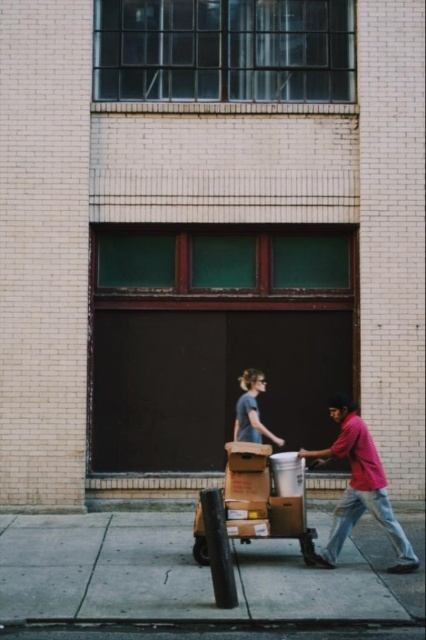
Is matte black trolley at center further to camera compared to matte gray shirt at center?

No, it is not.

In the scene shown: Does matte black trolley at center have a lesser width compared to matte gray shirt at center?

Incorrect, matte black trolley at center's width is not less than matte gray shirt at center's.

Where is `matte black trolley at center`? This screenshot has width=426, height=640. matte black trolley at center is located at coordinates (265, 496).

The height and width of the screenshot is (640, 426). What do you see at coordinates (184, 572) in the screenshot?
I see `gray concrete sidewalk at lower center` at bounding box center [184, 572].

Based on the photo, who is more distant from viewer, (322, 608) or (325, 461)?

Positioned behind is point (325, 461).

This screenshot has height=640, width=426. I want to click on gray concrete sidewalk at lower center, so click(184, 572).

Is pink matte shirt at right in front of matte gray shirt at center?

That is True.

Can you confirm if pink matte shirt at right is positioned above matte gray shirt at center?

No.

Describe the element at coordinates (359, 488) in the screenshot. The width and height of the screenshot is (426, 640). I see `pink matte shirt at right` at that location.

The width and height of the screenshot is (426, 640). I want to click on pink matte shirt at right, so click(359, 488).